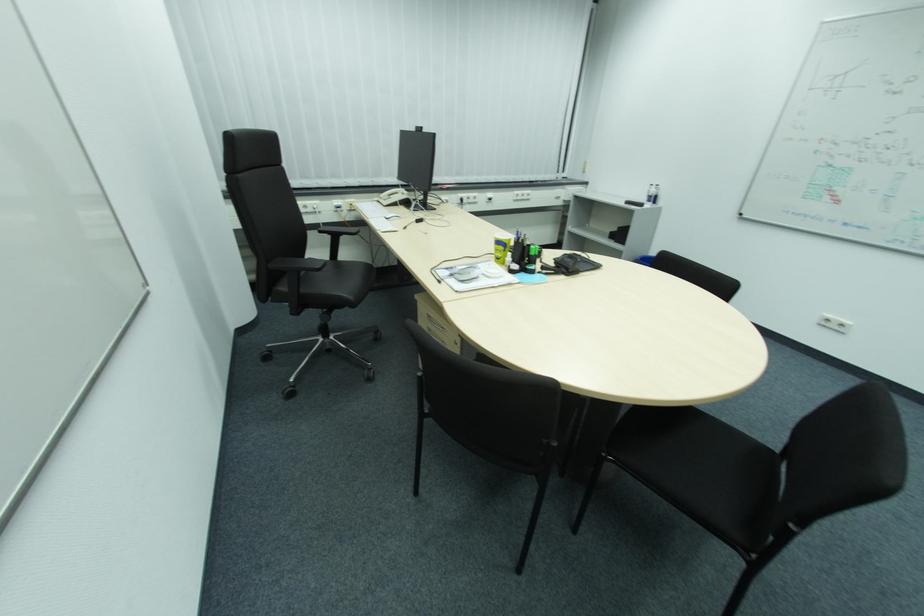
Locate an element on the screen. white telephone handset is located at coordinates pyautogui.click(x=387, y=192).